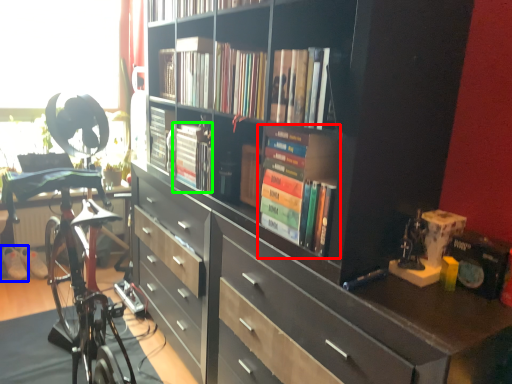
Question: Estimate the real-world distances between objects in this image. Which object is closer to book (highlighted by a red box), footwear (highlighted by a blue box) or book (highlighted by a green box)?

Choices:
 (A) footwear
 (B) book

Answer: (B)